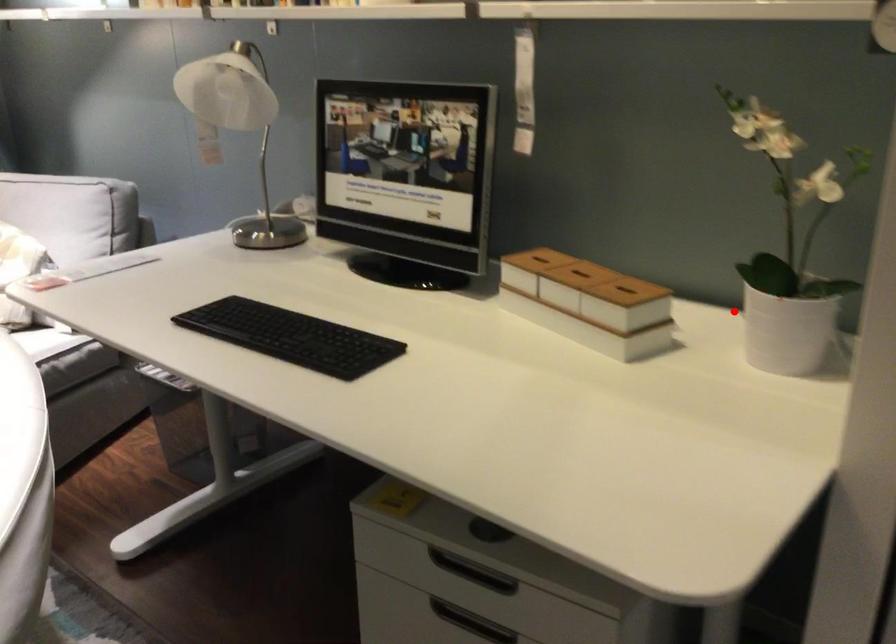
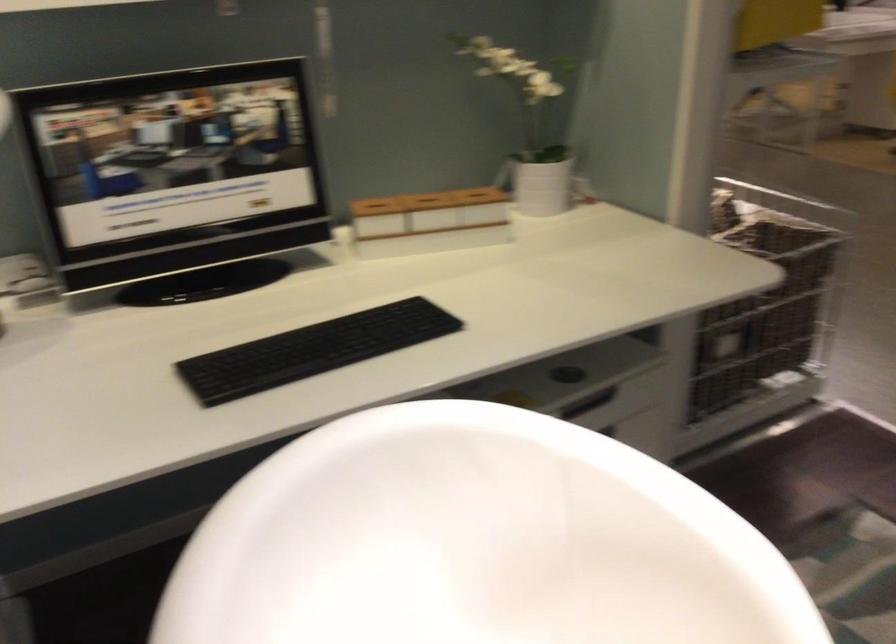
Question: I am providing you with two images of the same scene from different viewpoints. In image1, a red point is highlighted. Considering the same 3D point in image2, which of the following is correct?

Choices:
 (A) It is closer
 (B) It is farther

Answer: (B)